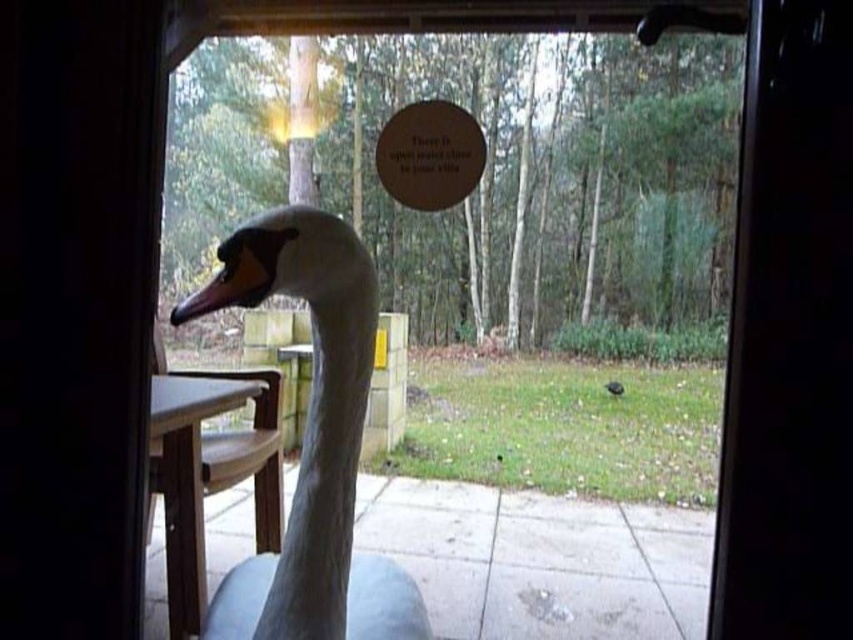
Question: Which object is the farthest from the transparent glass screen door at center?

Choices:
 (A) wooden plaque at center
 (B) white matte swan at center

Answer: (A)

Question: Does transparent glass screen door at center have a smaller size compared to white matte swan at center?

Choices:
 (A) no
 (B) yes

Answer: (B)

Question: Which object is closer to the camera taking this photo?

Choices:
 (A) matte orange beak at center
 (B) transparent glass door at center

Answer: (A)

Question: Can you confirm if transparent glass screen door at center is positioned to the right of transparent glass door at center?

Choices:
 (A) yes
 (B) no

Answer: (A)

Question: Based on their relative distances, which object is nearer to the transparent glass door at center?

Choices:
 (A) matte orange beak at center
 (B) wooden plaque at center

Answer: (B)

Question: Does transparent glass door at center appear on the left side of matte orange beak at center?

Choices:
 (A) no
 (B) yes

Answer: (A)